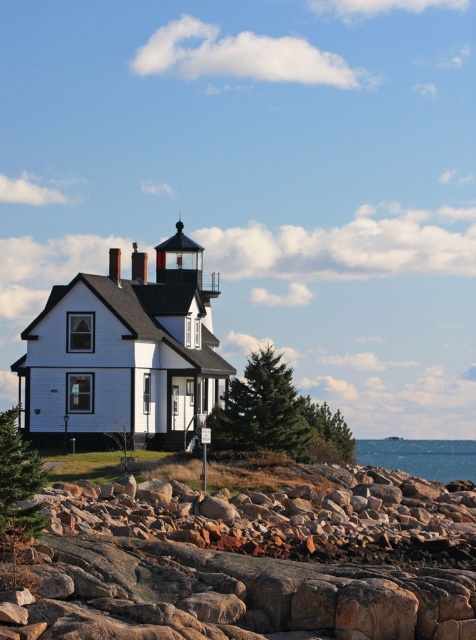
You are a geologist examining the coastal terrain. You notice a specific point marked at coordinates (x=243, y=564) in the image. Based on the scene description, what type of terrain feature is located at that point?

The point at (x=243, y=564) indicates rockyrough texturedrocks at lower right.

You are a geologist examining the coastal scene. You need to locate the rockyrough texturedrocks at lower right. What are their coordinates?

The coordinates for the rockyrough texturedrocks at lower right are point (243,564).

You are standing at the edge of the rocky shoreline and want to place a 30 meter long boat between you and the rockyrough texturedrocks at lower right. Is there enough space?

The distance between you and the rockyrough texturedrocks at lower right is 26.89 meters. Since the boat is 30 meters long, it won not fit in the available space.